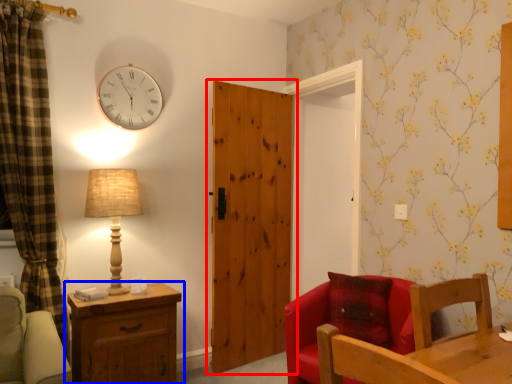
Question: Which object is further to the camera taking this photo, door (highlighted by a red box) or chest of drawers (highlighted by a blue box)?

Choices:
 (A) door
 (B) chest of drawers

Answer: (A)